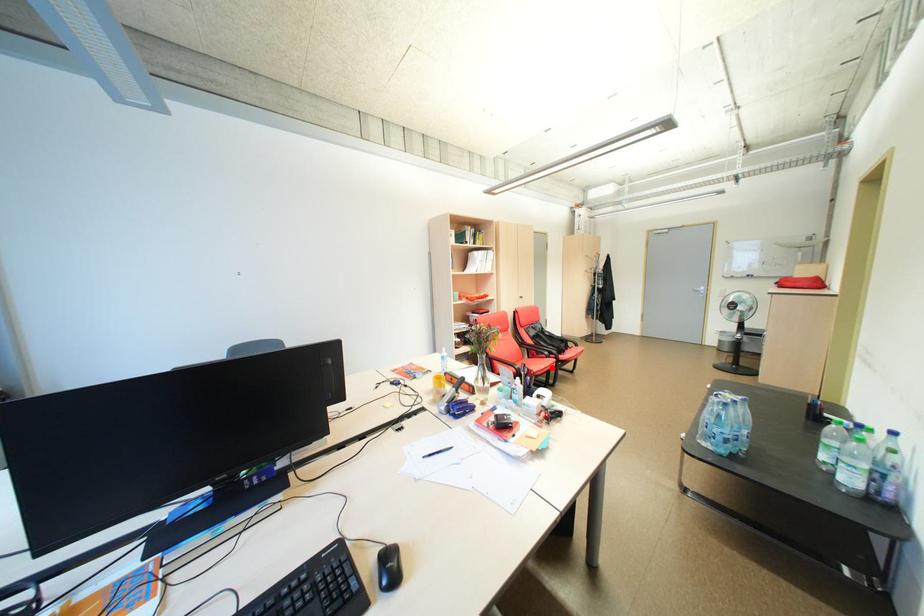
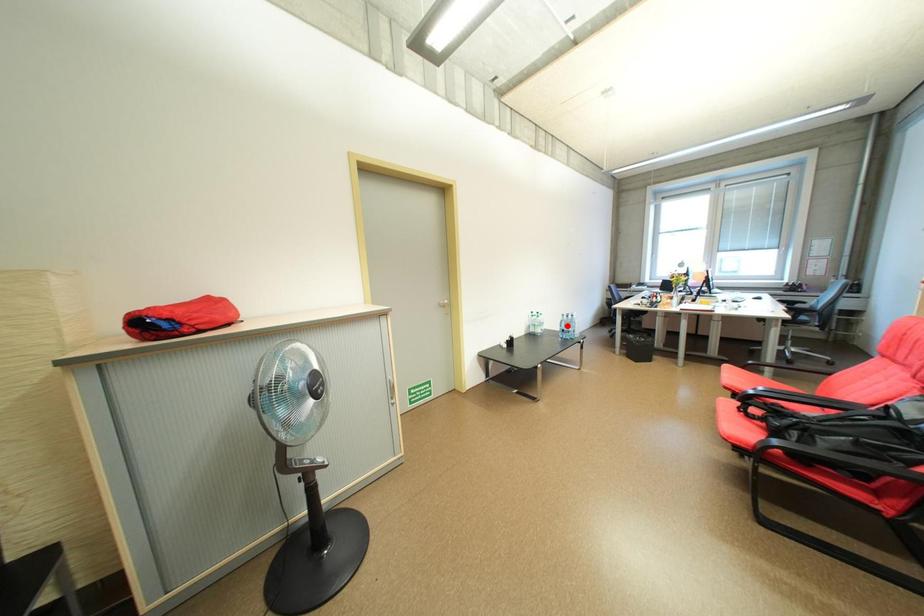
Based on the photo, I am providing you with two images of the same scene from different viewpoints. A red point is marked on the first image and another point is marked on the second image. Are the points marked in image1 and image2 representing the same 3D position?

No